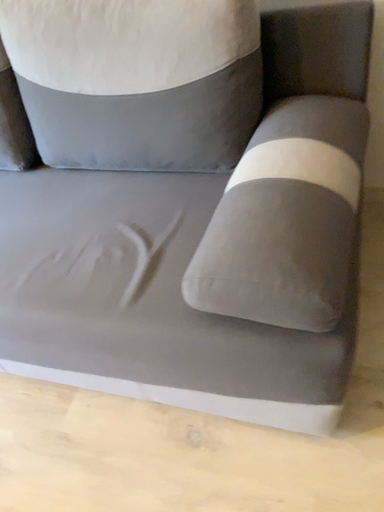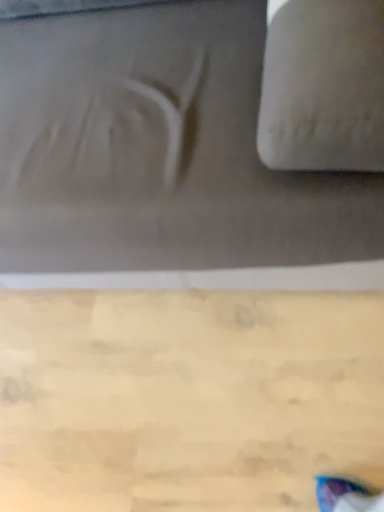
Question: How did the camera likely rotate when shooting the video?

Choices:
 (A) rotated upward
 (B) rotated downward

Answer: (B)